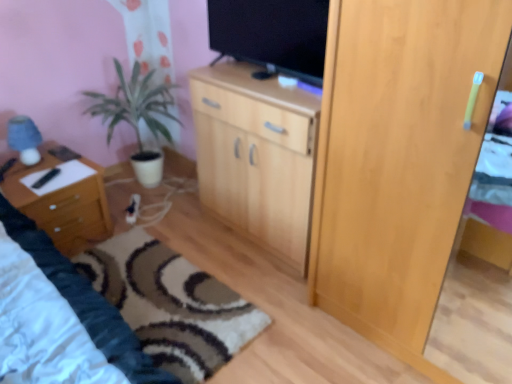
You are a GUI agent. You are given a task and a screenshot of the screen. Output one action in this format:
    pyautogui.click(x=<x>, y=<y>)
    Task: Click on the vacant space to the right of carpet with swirl pattern at lower center
    
    Given the screenshot: What is the action you would take?
    pyautogui.click(x=285, y=309)